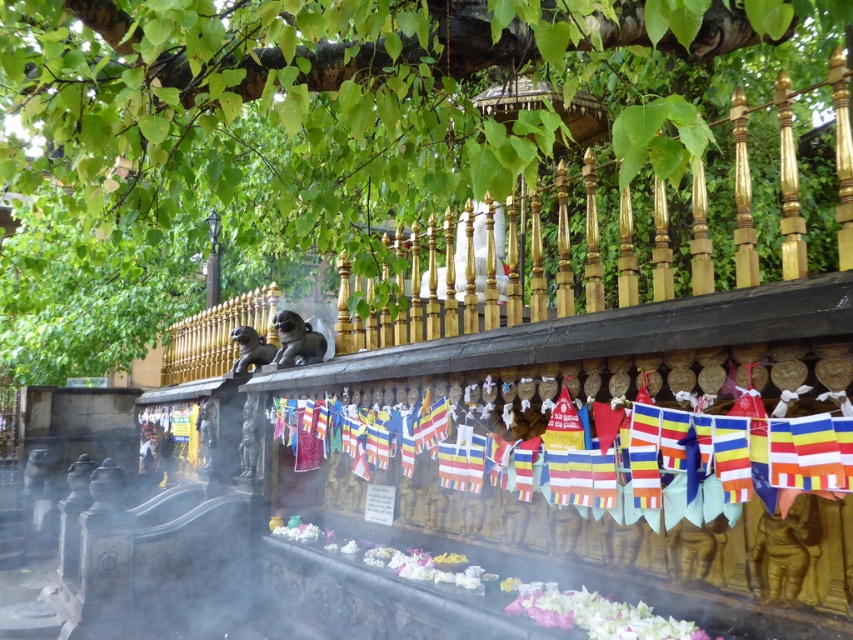
Question: Can you confirm if green leafy tree at upper center is positioned to the right of multi-colored fabric flags at center?

Choices:
 (A) no
 (B) yes

Answer: (A)

Question: Which point is closer to the camera?

Choices:
 (A) green leafy tree at upper center
 (B) multi-colored fabric flags at center

Answer: (A)

Question: Which object appears closest to the camera in this image?

Choices:
 (A) green leafy tree at upper center
 (B) multi-colored fabric flags at center

Answer: (A)

Question: Is green leafy tree at upper center below multi-colored fabric flags at center?

Choices:
 (A) no
 (B) yes

Answer: (A)

Question: Which object is farther from the camera taking this photo?

Choices:
 (A) green leafy tree at upper center
 (B) multi-colored fabric flags at center

Answer: (B)

Question: Does green leafy tree at upper center have a greater width compared to multi-colored fabric flags at center?

Choices:
 (A) yes
 (B) no

Answer: (B)